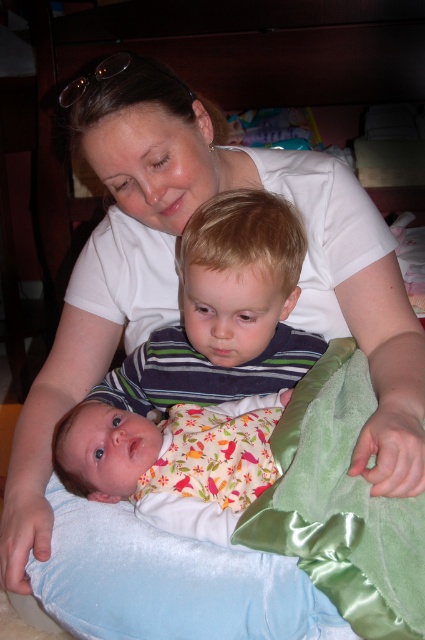
Question: Can you confirm if striped fabric shirt at center is thinner than floral fabric baby at lower left?

Choices:
 (A) no
 (B) yes

Answer: (A)

Question: Does striped fabric shirt at center appear over floral fabric baby at lower left?

Choices:
 (A) no
 (B) yes

Answer: (B)

Question: Does striped fabric shirt at center appear on the right side of floral fabric baby at lower left?

Choices:
 (A) yes
 (B) no

Answer: (A)

Question: Which point appears farthest from the camera in this image?

Choices:
 (A) (229, 515)
 (B) (285, 371)

Answer: (B)

Question: Which point is closer to the camera?

Choices:
 (A) floral fabric baby at lower left
 (B) striped fabric shirt at center

Answer: (A)